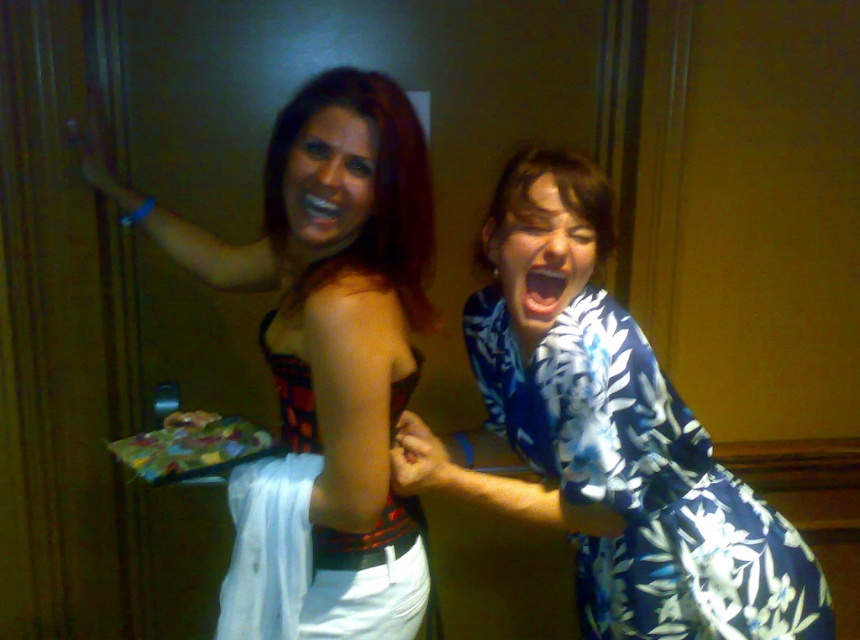
Question: Is blue floral dress at right closer to the viewer compared to red plaid fabric dress at center?

Choices:
 (A) no
 (B) yes

Answer: (A)

Question: Which point is farther to the camera?

Choices:
 (A) blue floral dress at right
 (B) matte black dress at left

Answer: (A)

Question: In this image, where is blue floral dress at right located relative to bright white teeth at center?

Choices:
 (A) above
 (B) below

Answer: (B)

Question: Does bright white teeth at center appear on the left side of matte black mouth at center?

Choices:
 (A) yes
 (B) no

Answer: (B)

Question: Estimate the real-world distances between objects in this image. Which object is farther from the matte black mouth at center?

Choices:
 (A) bright white teeth at center
 (B) shiny red hair at center
 (C) matte black dress at left
 (D) blue floral dress at right

Answer: (D)

Question: Which object is closer to the camera taking this photo?

Choices:
 (A) red plaid fabric dress at center
 (B) bright white teeth at center
 (C) blue floral dress at right
 (D) matte black mouth at center

Answer: (A)